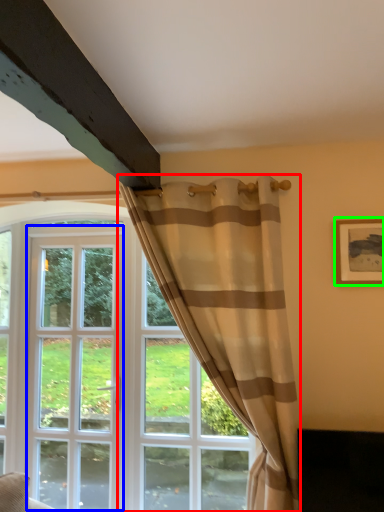
Question: Considering the real-world distances, which object is farthest from curtain (highlighted by a red box)? screen door (highlighted by a blue box) or picture frame (highlighted by a green box)?

Choices:
 (A) screen door
 (B) picture frame

Answer: (A)